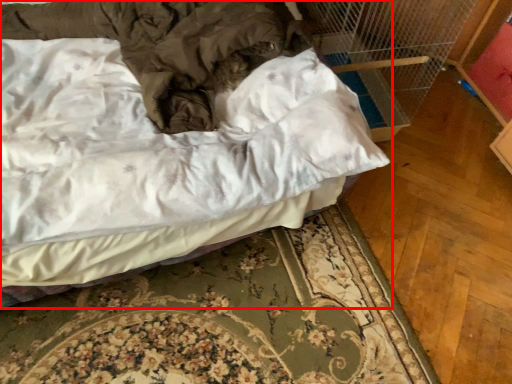
Question: Observing the image, what is the correct spatial positioning of bed (annotated by the red box) in reference to bed frame?

Choices:
 (A) right
 (B) left

Answer: (B)